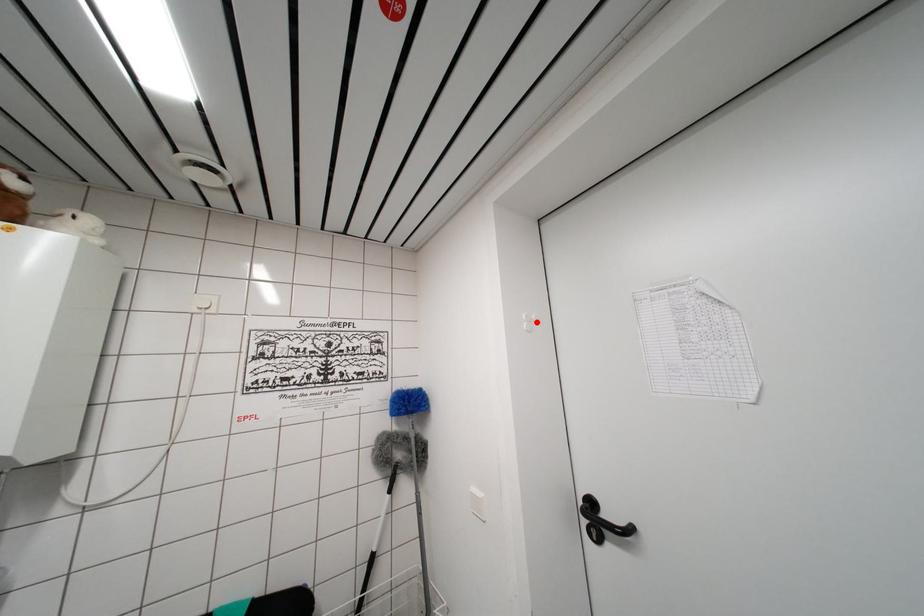
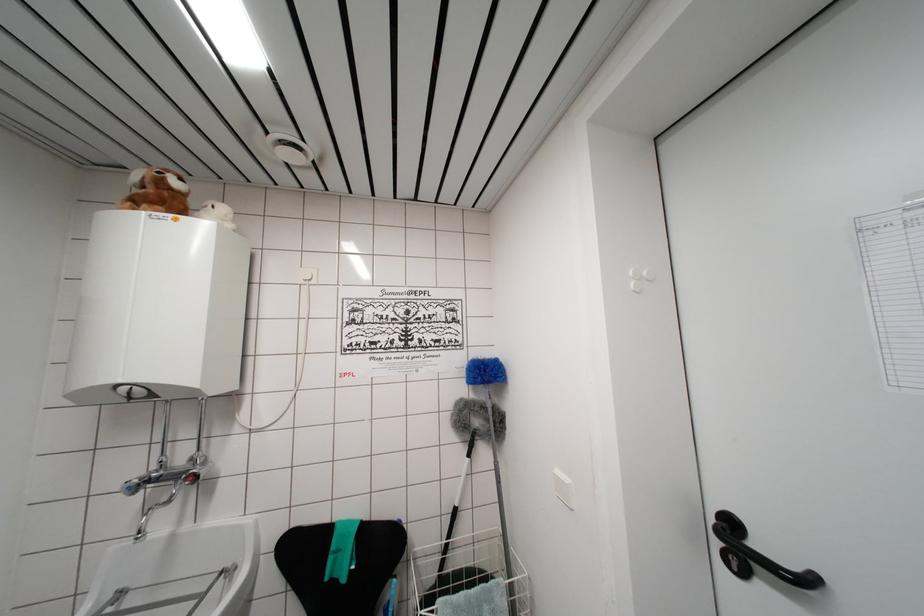
Find the pixel in the second image that matches the highlighted location in the first image.

(649, 278)